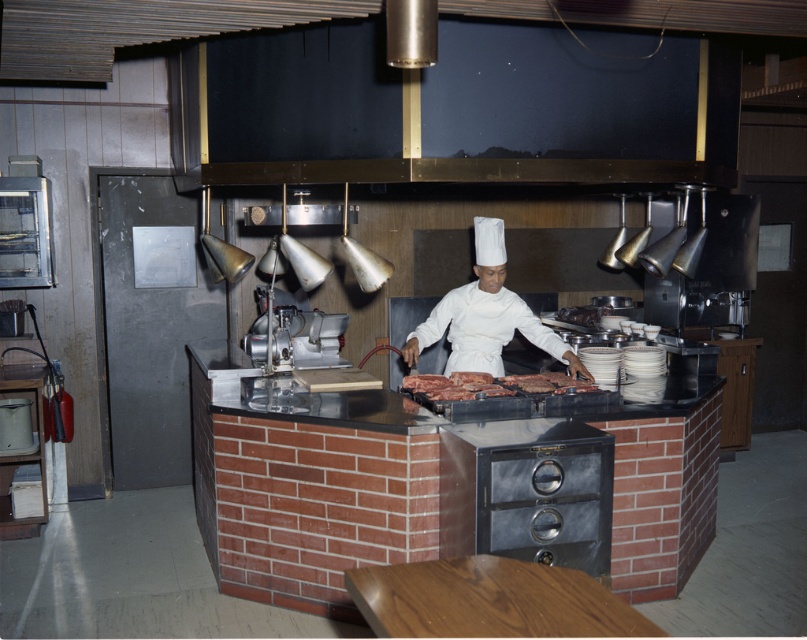
Between white chef's uniform at center and dark brown meat at center, which one appears on the right side from the viewer's perspective?

From the viewer's perspective, dark brown meat at center appears more on the right side.

Who is higher up, white chef's uniform at center or dark brown meat at center?

white chef's uniform at center is higher up.

What are the coordinates of `white chef's uniform at center` in the screenshot? It's located at (484, 316).